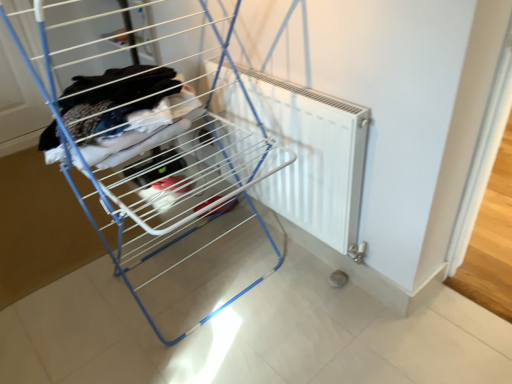
Question: From the image's perspective, does white matte radiator at center appear lower than white plastic radiator at center?

Choices:
 (A) yes
 (B) no

Answer: (A)

Question: Does white matte radiator at center have a lesser width compared to white plastic radiator at center?

Choices:
 (A) no
 (B) yes

Answer: (B)

Question: Considering the relative sizes of white matte radiator at center and white plastic radiator at center in the image provided, is white matte radiator at center shorter than white plastic radiator at center?

Choices:
 (A) yes
 (B) no

Answer: (A)

Question: Does white matte radiator at center touch white plastic radiator at center?

Choices:
 (A) yes
 (B) no

Answer: (B)

Question: Is the position of white matte radiator at center less distant than that of white plastic radiator at center?

Choices:
 (A) yes
 (B) no

Answer: (B)

Question: Is white matte radiator at center outside white plastic radiator at center?

Choices:
 (A) yes
 (B) no

Answer: (A)

Question: Is white plastic radiator at center oriented away from white matte radiator at center?

Choices:
 (A) yes
 (B) no

Answer: (A)

Question: Is white plastic radiator at center positioned far away from white matte radiator at center?

Choices:
 (A) yes
 (B) no

Answer: (B)

Question: Can you confirm if white plastic radiator at center is bigger than white matte radiator at center?

Choices:
 (A) no
 (B) yes

Answer: (B)

Question: Does white plastic radiator at center have a greater height compared to white matte radiator at center?

Choices:
 (A) no
 (B) yes

Answer: (B)

Question: Can you confirm if white plastic radiator at center is smaller than white matte radiator at center?

Choices:
 (A) yes
 (B) no

Answer: (B)

Question: Is white plastic radiator at center placed right next to white matte radiator at center?

Choices:
 (A) yes
 (B) no

Answer: (B)

Question: Considering the positions of white matte radiator at center and white plastic radiator at center in the image, is white matte radiator at center wider or thinner than white plastic radiator at center?

Choices:
 (A) wide
 (B) thin

Answer: (B)